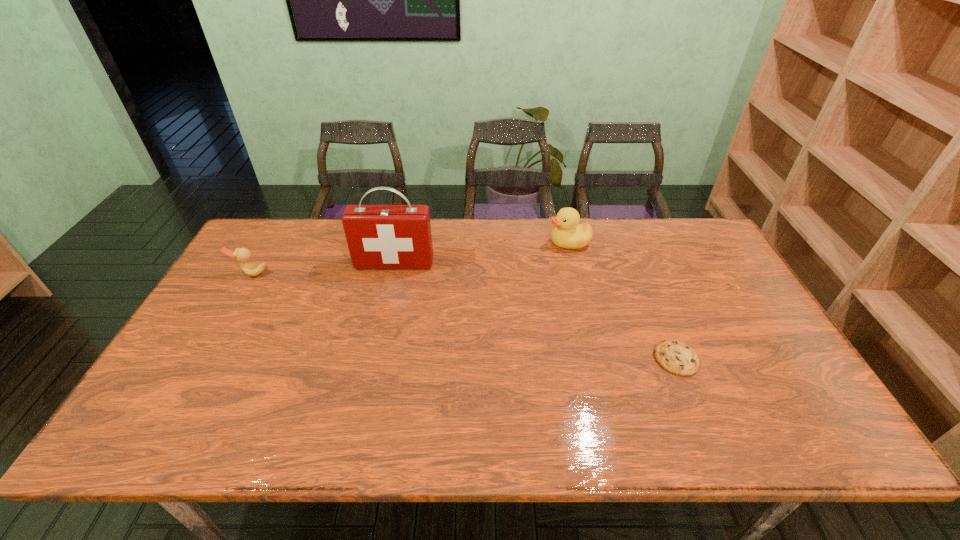
At what (x,y) coordinates should I click in order to perform the action: click on free space in the image that satisfies the following two spatial constraints: 1. on the front face of the cookie; 2. on the left side of the tallest object. Please return your answer as a coordinate pair (x, y). Looking at the image, I should click on (372, 359).